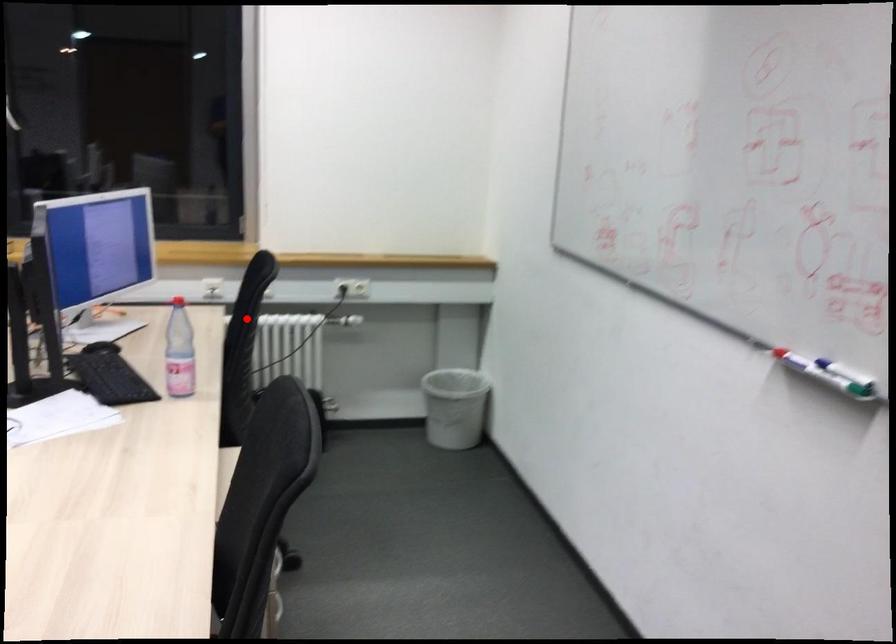
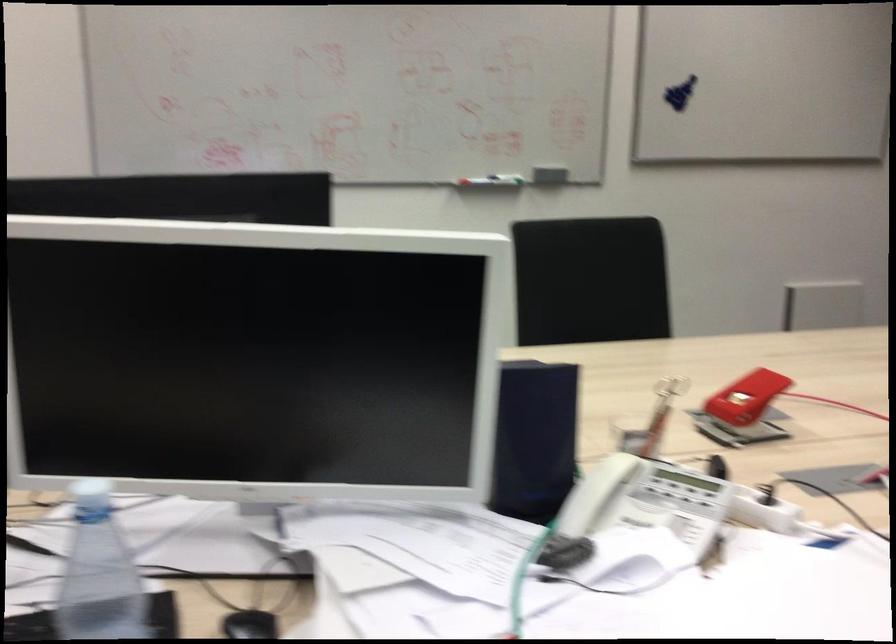
Question: I am providing you with two images of the same scene from different viewpoints. A red point is marked on the first image. Can you still see the location of the red point in image 2?

Choices:
 (A) Yes
 (B) No

Answer: (B)